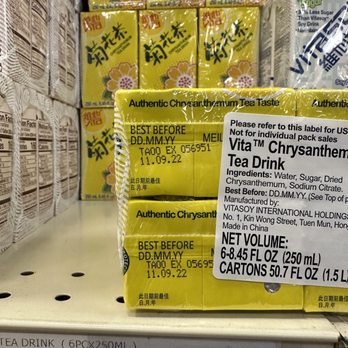
At what (x,y) coordinates should I click in order to perform the action: click on metal shelf. Please return your answer as a coordinate pair (x, y). Looking at the image, I should click on (89, 304).